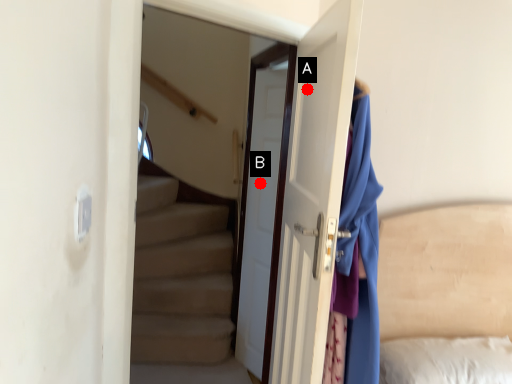
Question: Two points are circled on the image, labeled by A and B beside each circle. Which point is closer to the camera?

Choices:
 (A) A is closer
 (B) B is closer

Answer: (A)